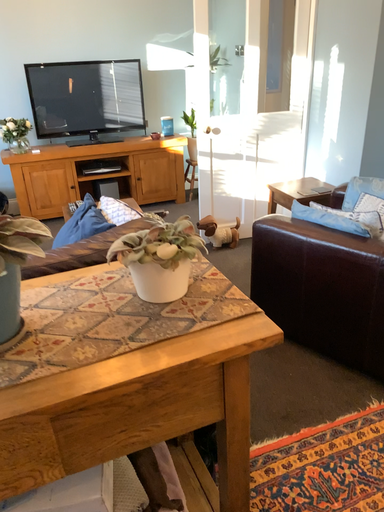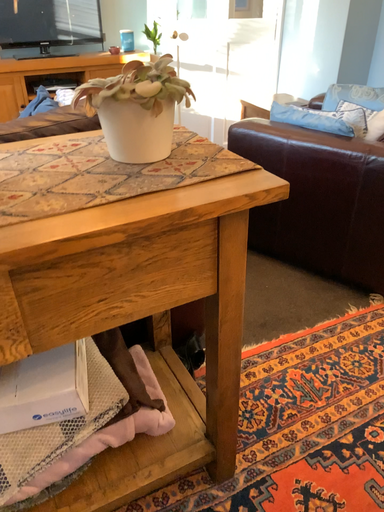
Question: How did the camera likely rotate when shooting the video?

Choices:
 (A) rotated downward
 (B) rotated upward

Answer: (A)